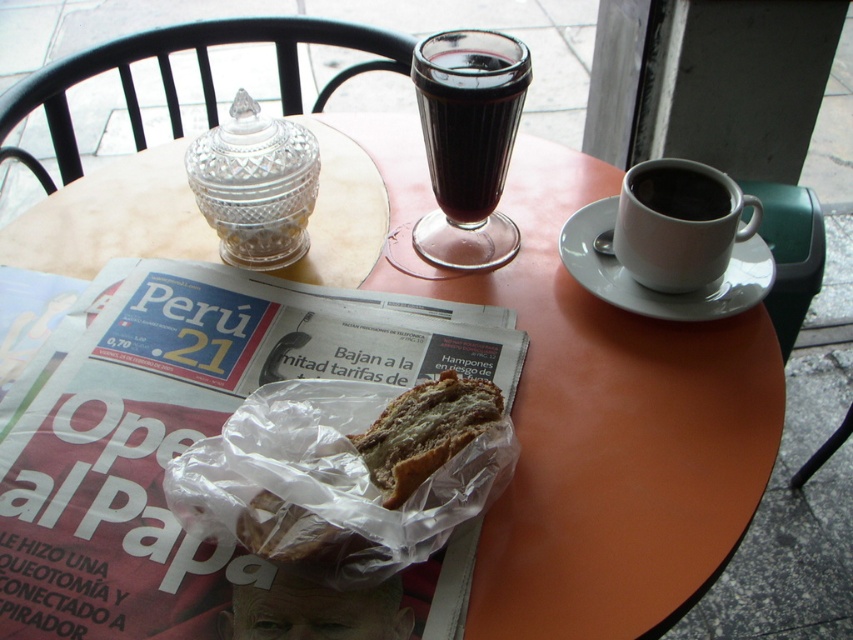
Question: Is the position of white ceramic saucer at upper right less distant than that of black matte cup at upper right?

Choices:
 (A) no
 (B) yes

Answer: (B)

Question: Is dark glassy beverage at upper center below white glossy cup at upper right?

Choices:
 (A) yes
 (B) no

Answer: (B)

Question: Is brown crusty bread at center below white ceramic saucer at upper right?

Choices:
 (A) yes
 (B) no

Answer: (A)

Question: Among these objects, which one is nearest to the camera?

Choices:
 (A) white ceramic saucer at upper right
 (B) white glossy cup at upper right
 (C) dark glassy beverage at upper center

Answer: (B)

Question: Which point is closer to the camera?

Choices:
 (A) (724, 188)
 (B) (445, 237)
 (C) (381, 436)

Answer: (C)

Question: Among these objects, which one is nearest to the camera?

Choices:
 (A) brown crusty bread at center
 (B) dark glassy beverage at upper center

Answer: (A)